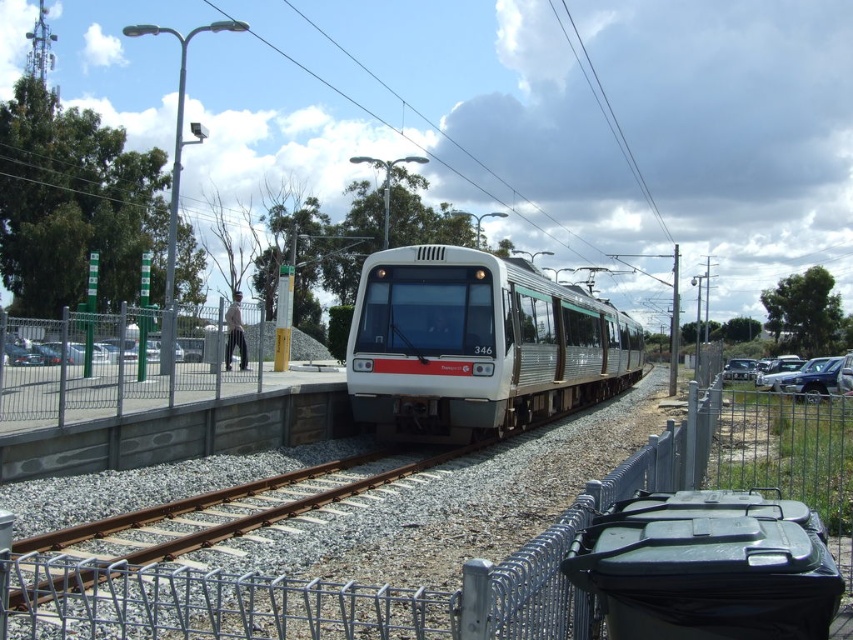
Who is higher up, white glossy train at center or rusty metal train track at center?

white glossy train at center

Which is in front, point (386, 353) or point (67, 582)?

Positioned in front is point (67, 582).

The height and width of the screenshot is (640, 853). I want to click on white glossy train at center, so click(477, 344).

Can you confirm if white glossy train at center is thinner than metallic silver car at right?

No.

Does point (440, 296) lie behind point (811, 388)?

No.

What do you see at coordinates (477, 344) in the screenshot?
I see `white glossy train at center` at bounding box center [477, 344].

Image resolution: width=853 pixels, height=640 pixels. I want to click on white glossy train at center, so click(477, 344).

Which is behind, point (328, 474) or point (820, 385)?

Positioned behind is point (820, 385).

Can you confirm if rusty metal train track at center is positioned to the left of metallic silver car at right?

Indeed, rusty metal train track at center is positioned on the left side of metallic silver car at right.

Find the location of a particular element. This screenshot has height=640, width=853. rusty metal train track at center is located at coordinates click(x=207, y=518).